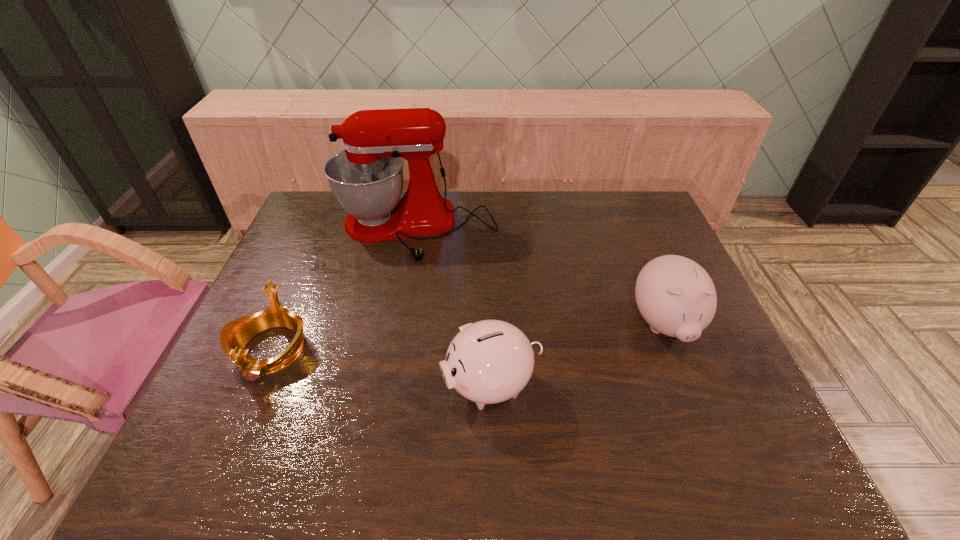
Locate an element on the screen. The height and width of the screenshot is (540, 960). mixer is located at coordinates (366, 178).

Identify the location of the tallest object. (366, 178).

Identify the location of the right piggy bank. This screenshot has width=960, height=540. (676, 296).

Image resolution: width=960 pixels, height=540 pixels. Find the location of `the left piggy bank`. the left piggy bank is located at coordinates (490, 361).

In order to click on tiara in this screenshot , I will do `click(234, 336)`.

Locate an element on the screen. The image size is (960, 540). free region located 0.200m on the bowl side of the mixer is located at coordinates (399, 313).

The height and width of the screenshot is (540, 960). I want to click on vacant space located 0.090m at the snout of the right piggy bank, so click(x=692, y=395).

Identify the location of free location located on the right of the left piggy bank. This screenshot has width=960, height=540. [x=602, y=385].

You are a GUI agent. You are given a task and a screenshot of the screen. Output one action in this format:
    pyautogui.click(x=<x>, y=<y>)
    Task: Click on the vacant space located at the front emblem of the tiara
    The width and height of the screenshot is (960, 540).
    Given the screenshot: What is the action you would take?
    239,423

Find the location of a particular element. Image resolution: width=960 pixels, height=540 pixels. object at the far edge is located at coordinates (366, 178).